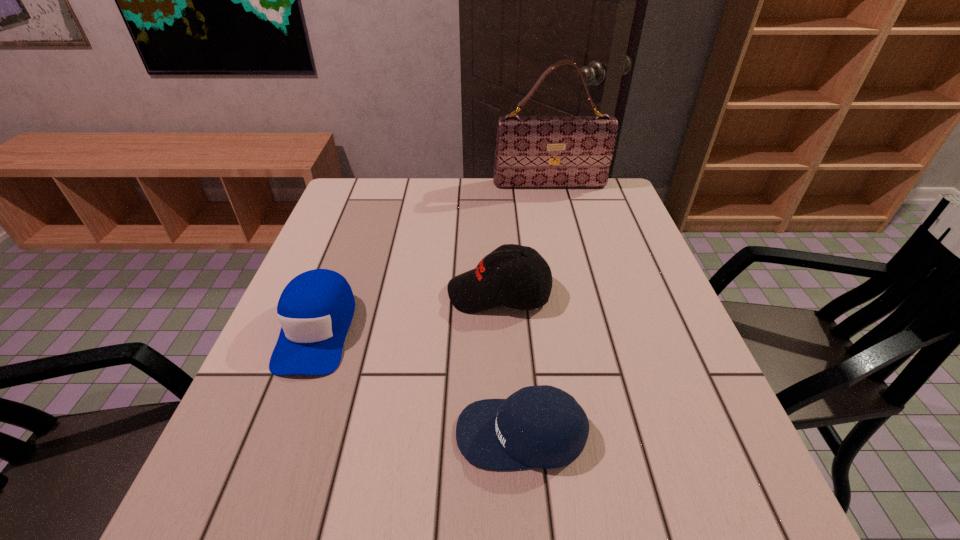
At what (x,y) coordinates should I click in order to perform the action: click on handbag. Please return your answer as a coordinate pair (x, y). Looking at the image, I should click on (531, 151).

Locate an element on the screen. The height and width of the screenshot is (540, 960). the tallest object is located at coordinates (531, 151).

Identify the location of the leftmost baseball cap. Image resolution: width=960 pixels, height=540 pixels. (315, 309).

The width and height of the screenshot is (960, 540). In order to click on the second shortest baseball cap in this screenshot , I will do `click(315, 309)`.

In order to click on the nearest baseball cap in this screenshot , I will do `click(542, 426)`.

Locate an element on the screen. The width and height of the screenshot is (960, 540). the nearest object is located at coordinates (542, 426).

Image resolution: width=960 pixels, height=540 pixels. In order to click on vacant region located on the front of the tallest object with the clasp in this screenshot , I will do `click(560, 225)`.

The image size is (960, 540). I want to click on free space located on the front-facing side of the second shortest baseball cap, so click(259, 483).

Locate an element on the screen. The height and width of the screenshot is (540, 960). free point located on the front-facing side of the shortest baseball cap is located at coordinates (293, 433).

I want to click on free space located 0.390m on the front-facing side of the shortest baseball cap, so click(229, 433).